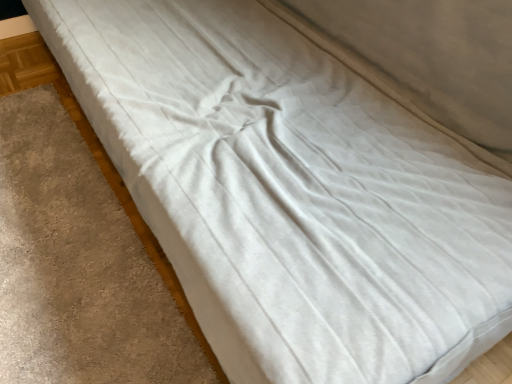
Identify the location of white fabric at lower left. This screenshot has height=384, width=512. click(x=77, y=266).

The height and width of the screenshot is (384, 512). What do you see at coordinates (77, 266) in the screenshot?
I see `white fabric at lower left` at bounding box center [77, 266].

At what (x,y) coordinates should I click in order to perform the action: click on white fabric at lower left. Please return your answer as a coordinate pair (x, y). This screenshot has width=512, height=384. Looking at the image, I should click on (77, 266).